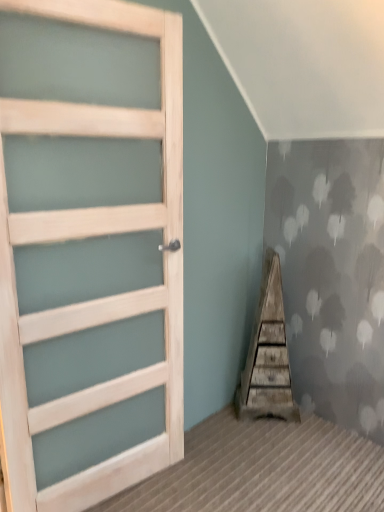
I want to click on vacant position to the left of weathered wood stairwell at center, so click(x=223, y=423).